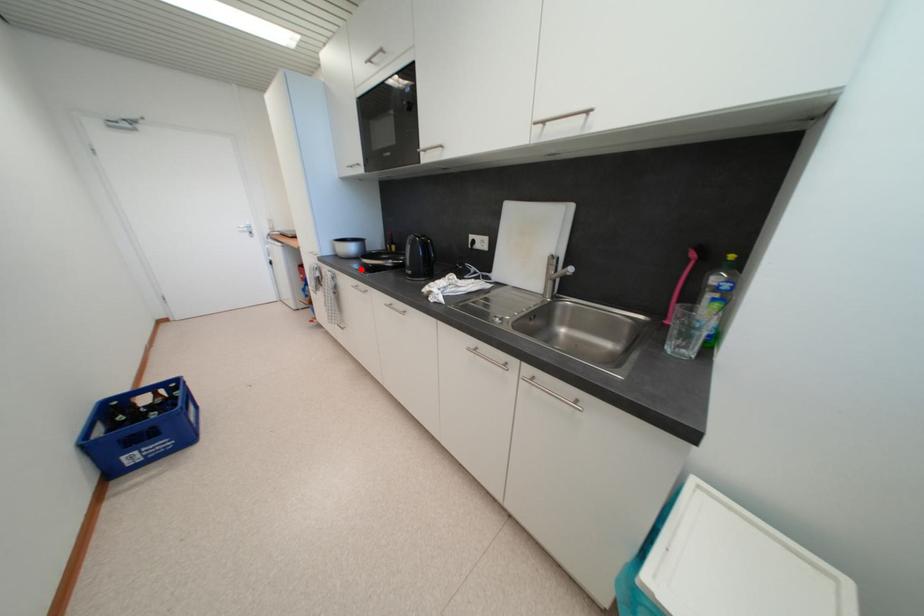
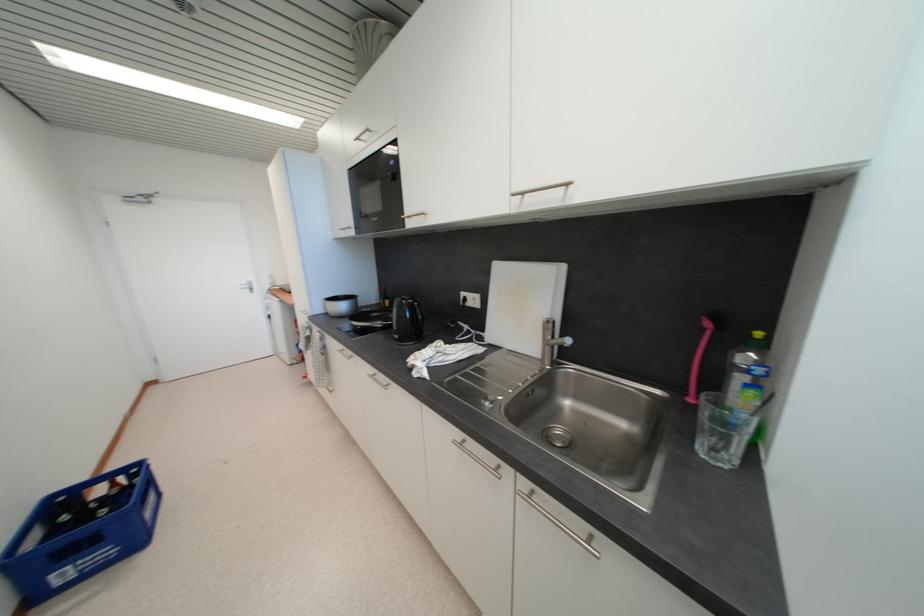
In the second image, find the point that corresponds to the highlighted location in the first image.

(351, 328)